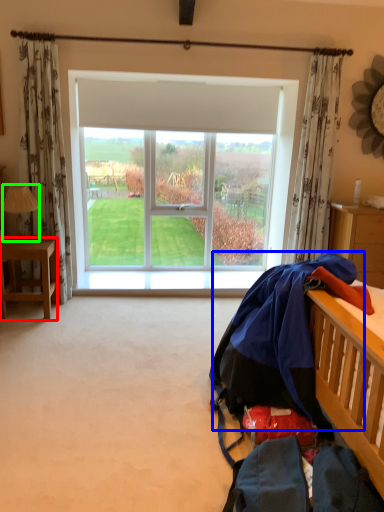
Question: Which object is the farthest from desk (highlighted by a red box)? Choose among these: clothing (highlighted by a blue box) or lamp (highlighted by a green box).

Choices:
 (A) clothing
 (B) lamp

Answer: (A)